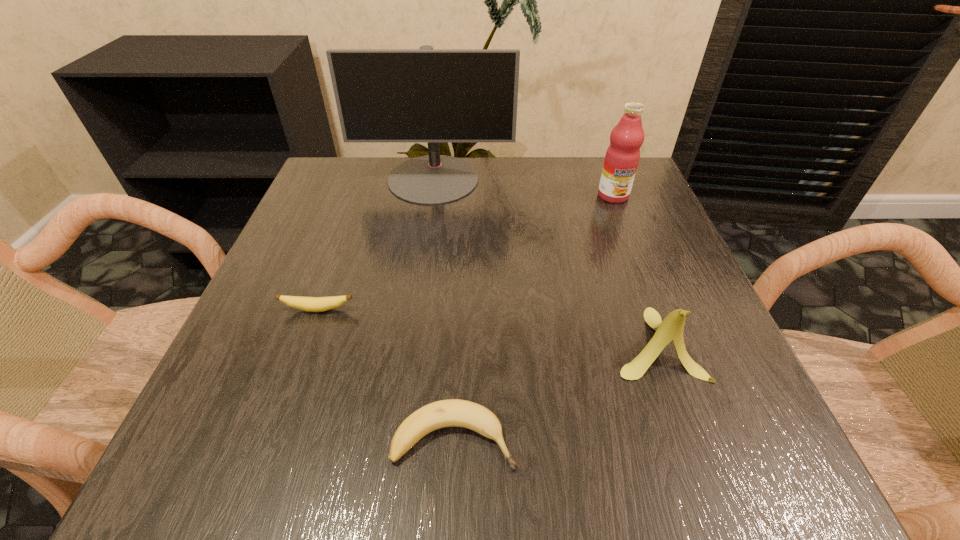
You are a GUI agent. You are given a task and a screenshot of the screen. Output one action in this format:
    pyautogui.click(x=<x>, y=<y>)
    Task: Click on the free space between the second banana from right to left and the fruit juice
    The height and width of the screenshot is (540, 960).
    Given the screenshot: What is the action you would take?
    pyautogui.click(x=534, y=318)

Where is `free space between the third shortest object and the nearest banana`? free space between the third shortest object and the nearest banana is located at coordinates coord(555,391).

Where is `free space between the computer monitor and the fourth shortest object`? This screenshot has width=960, height=540. free space between the computer monitor and the fourth shortest object is located at coordinates pos(523,187).

Identify the location of vacant area between the fruit juice and the third shortest object. (634, 269).

In order to click on vacant point located between the leftmost banana and the nearest object in this screenshot , I will do `click(386, 374)`.

Identify the location of empty location between the computer monitor and the third shortest object. The image size is (960, 540). (544, 261).

At what (x,y) coordinates should I click in order to perform the action: click on vacant area that lies between the rightmost banana and the nearest banana. Please return your answer as a coordinate pair (x, y). The image size is (960, 540). Looking at the image, I should click on (555, 391).

Identify which object is located as the second nearest to the tallest object. Please provide its 2D coordinates. Your answer should be formatted as a tuple, i.e. [(x, y)], where the tuple contains the x and y coordinates of a point satisfying the conditions above.

[(311, 304)]

This screenshot has width=960, height=540. I want to click on object that is the fourth closest to the rightmost banana, so click(x=311, y=304).

The image size is (960, 540). In order to click on the closest banana relative to the leftmost banana in this screenshot , I will do `click(453, 412)`.